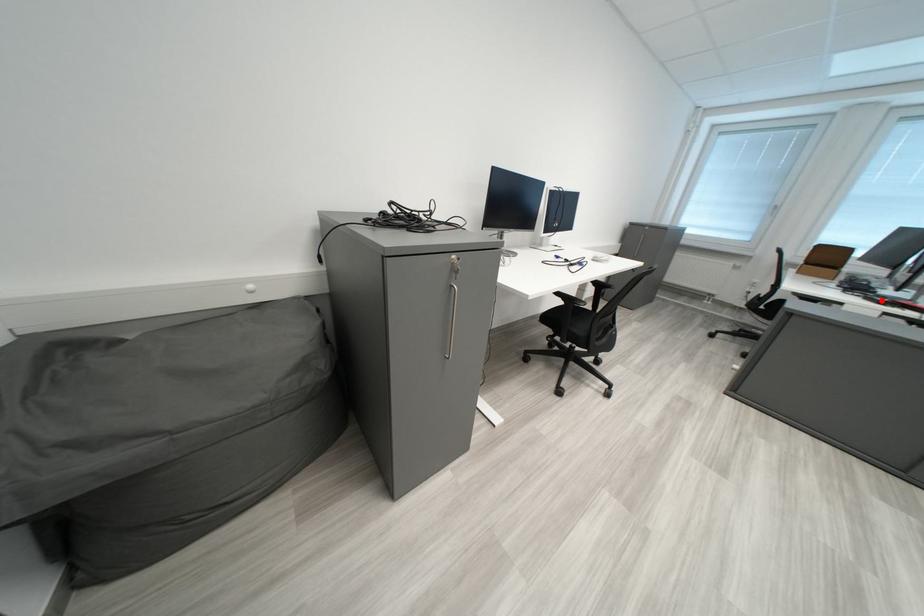
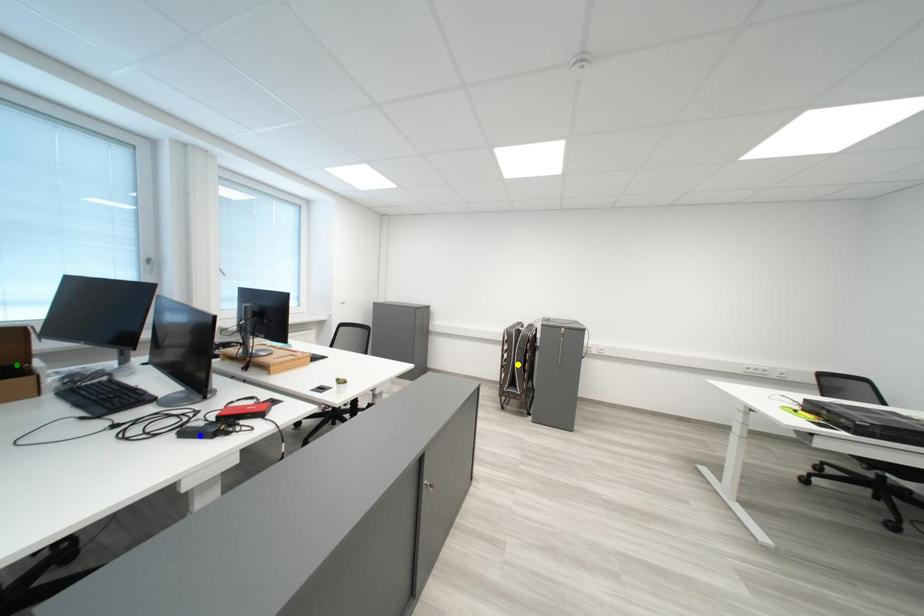
Question: I am providing you with two images of the same scene from different viewpoints. A red point is marked on the first image. You are given multiple points on the second image. In image 2, which mark is for the same physical point as the one in image 1?

Choices:
 (A) yellow point
 (B) blue point
 (C) green point

Answer: (B)